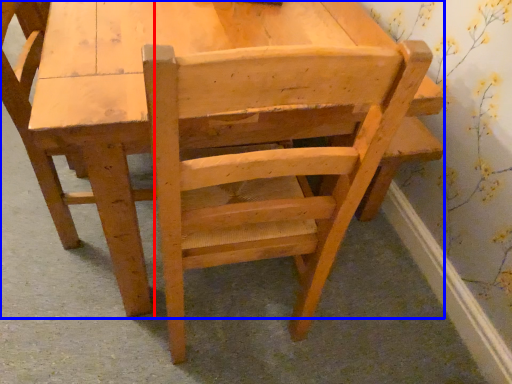
Question: Which object is further to the camera taking this photo, chair (highlighted by a red box) or chair (highlighted by a blue box)?

Choices:
 (A) chair
 (B) chair

Answer: (A)